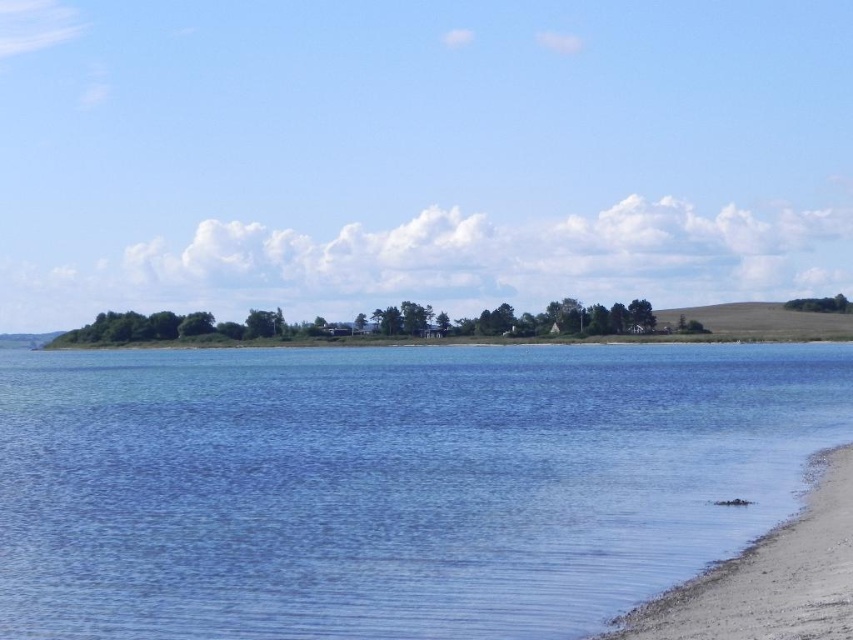
Between blue water at center and gray gravelly sand at lower right, which one is positioned lower?

Positioned lower is gray gravelly sand at lower right.

Describe the element at coordinates (392, 484) in the screenshot. I see `blue water at center` at that location.

This screenshot has height=640, width=853. What are the coordinates of `blue water at center` in the screenshot? It's located at (392, 484).